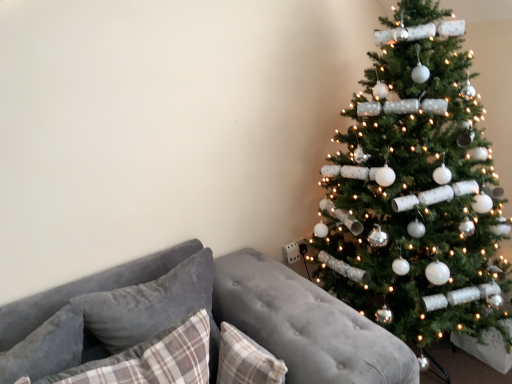
Question: Is plaid fabric pillow at lower left, which is counted as the 2th pillow, starting from the right, bigger or smaller than gray fabric pillow at lower left, arranged as the 4th pillow when viewed from the right?

Choices:
 (A) small
 (B) big

Answer: (B)

Question: From a real-world perspective, is plaid fabric pillow at lower left, which is the third pillow in left-to-right order, positioned above or below gray fabric pillow at lower left, arranged as the 4th pillow when viewed from the right?

Choices:
 (A) below
 (B) above

Answer: (A)

Question: Estimate the real-world distances between objects in this image. Which object is farther from the plaid fabric pillow at center, which appears as the 1th pillow when viewed from the right?

Choices:
 (A) plaid fabric pillow at lower left, which is the third pillow in left-to-right order
 (B) velvet gray couch at lower left
 (C) velvety gray pillow at left, which is the second pillow from left to right
 (D) shiny silver ornaments at right
 (E) gray fabric pillow at lower left, which is counted as the 1th pillow, starting from the left

Answer: (D)

Question: Estimate the real-world distances between objects in this image. Which object is closer to the shiny silver ornaments at right?

Choices:
 (A) plaid fabric pillow at center, which appears as the 1th pillow when viewed from the right
 (B) gray fabric pillow at lower left, arranged as the 4th pillow when viewed from the right
 (C) velvety gray pillow at left, which is the second pillow from left to right
 (D) plaid fabric pillow at lower left, which is the third pillow in left-to-right order
 (E) velvet gray couch at lower left

Answer: (E)